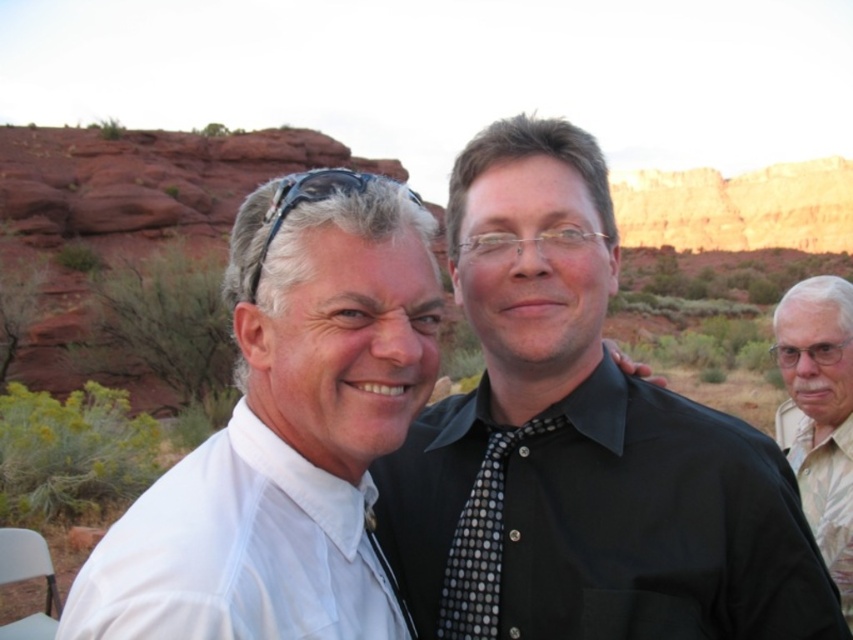
Question: Which of the following is the closest to the observer?

Choices:
 (A) (793, 292)
 (B) (413, 524)
 (C) (496, 492)

Answer: (C)

Question: Does white shirt at center appear over gray textured shirt at right?

Choices:
 (A) no
 (B) yes

Answer: (B)

Question: Among these points, which one is nearest to the camera?

Choices:
 (A) (799, 369)
 (B) (322, 186)
 (C) (306, 541)

Answer: (C)

Question: In this image, where is black dotted tie at center located relative to black rubber sunglasses at upper left?

Choices:
 (A) right
 (B) left

Answer: (A)

Question: Which is nearer to the black rubber sunglasses at upper left?

Choices:
 (A) gray textured shirt at right
 (B) black dotted tie at center

Answer: (B)

Question: Is black dotted tie at center to the right of gray textured shirt at right from the viewer's perspective?

Choices:
 (A) yes
 (B) no

Answer: (B)